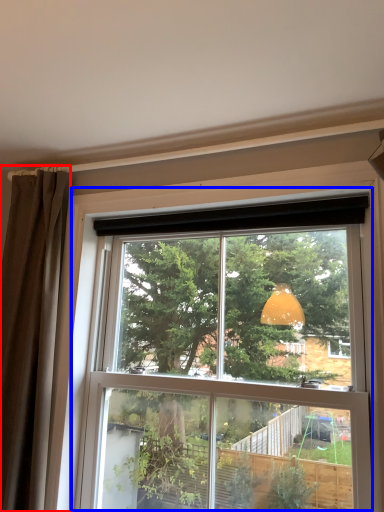
Question: Which object is closer to the camera taking this photo, curtain (highlighted by a red box) or window (highlighted by a blue box)?

Choices:
 (A) curtain
 (B) window

Answer: (B)